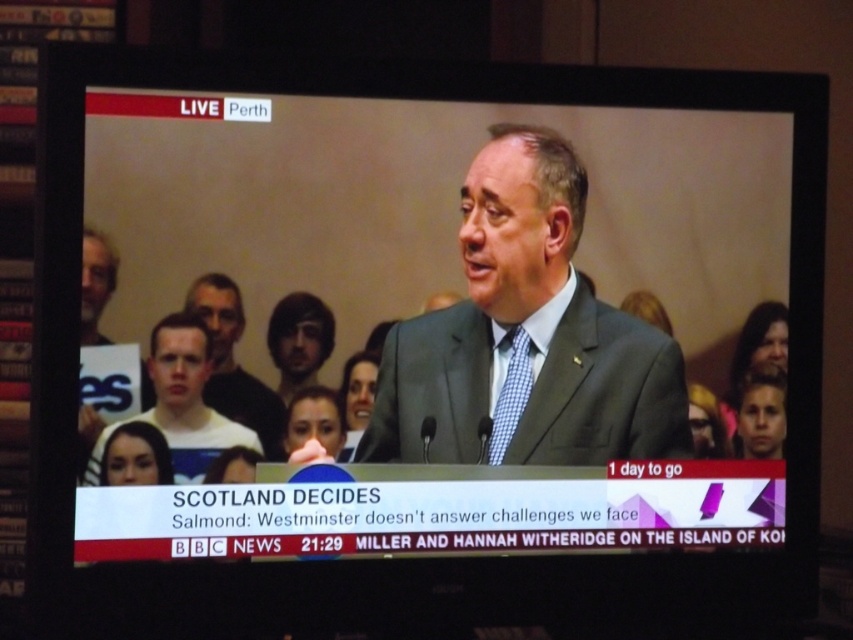
Question: Is white shirt at lower left to the right of light brown hair at left from the viewer's perspective?

Choices:
 (A) yes
 (B) no

Answer: (A)

Question: Which point is closer to the camera?

Choices:
 (A) white shirt at lower left
 (B) light brown hair at center
 (C) checkered fabric tie at center

Answer: (A)

Question: Which object is positioned farthest from the white shirt at lower left?

Choices:
 (A) checkered fabric tie at center
 (B) light brown hair at center
 (C) gray suit at center
 (D) light brown hair at left

Answer: (A)

Question: Which point is closer to the camera?

Choices:
 (A) gray suit at center
 (B) white shirt at lower left

Answer: (B)

Question: Can you confirm if gray suit at center is thinner than white shirt at lower left?

Choices:
 (A) no
 (B) yes

Answer: (A)

Question: Is gray suit at center to the left of light brown hair at left from the viewer's perspective?

Choices:
 (A) yes
 (B) no

Answer: (B)